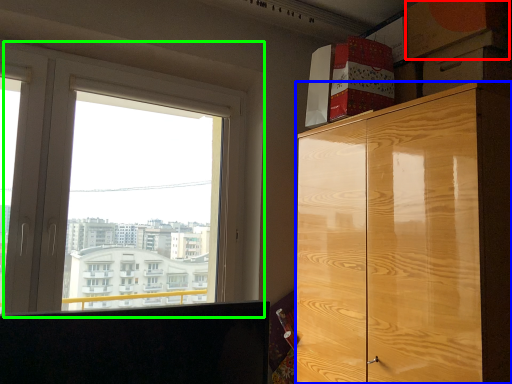
Question: Which object is the closest to the cardboard box (highlighted by a red box)? Choose among these: cabinetry (highlighted by a blue box) or window (highlighted by a green box).

Choices:
 (A) cabinetry
 (B) window

Answer: (A)